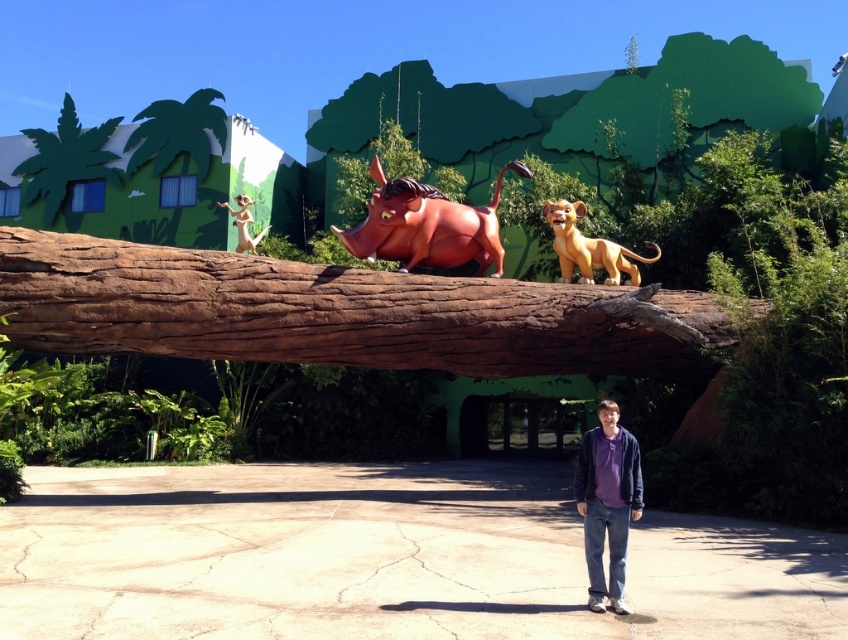
Between brown rough wood at center and golden matte lion at center, which one appears on the left side from the viewer's perspective?

From the viewer's perspective, brown rough wood at center appears more on the left side.

Can you confirm if brown rough wood at center is positioned to the right of golden matte lion at center?

In fact, brown rough wood at center is to the left of golden matte lion at center.

Describe the element at coordinates (339, 312) in the screenshot. This screenshot has height=640, width=848. I see `brown rough wood at center` at that location.

What are the coordinates of `brown rough wood at center` in the screenshot? It's located at (339, 312).

What do you see at coordinates (607, 502) in the screenshot? This screenshot has height=640, width=848. I see `purple cotton shirt at lower center` at bounding box center [607, 502].

Is point (594, 552) positioned after point (106, 170)?

That is False.

You are a GUI agent. You are given a task and a screenshot of the screen. Output one action in this format:
    pyautogui.click(x=<x>, y=<y>)
    Task: Click on the purple cotton shirt at lower center
    Image resolution: width=848 pixels, height=640 pixels.
    Given the screenshot: What is the action you would take?
    pyautogui.click(x=607, y=502)

Is green painted palm tree at upper left to the left of shiny silver monkey at upper left from the viewer's perspective?

Yes, green painted palm tree at upper left is to the left of shiny silver monkey at upper left.

Between green painted palm tree at upper left and shiny silver monkey at upper left, which one is positioned lower?

shiny silver monkey at upper left is lower down.

Who is more distant from viewer, (48, 172) or (238, 236)?

The point (48, 172) is behind.

The height and width of the screenshot is (640, 848). I want to click on green painted palm tree at upper left, so click(65, 157).